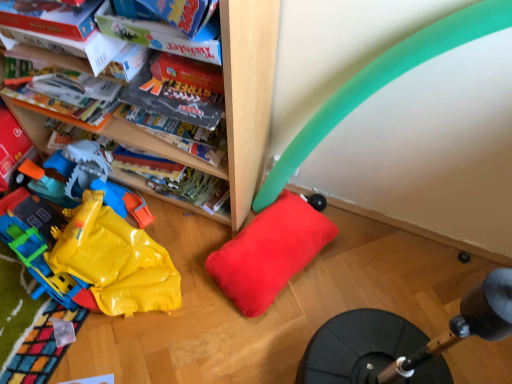
Where is `soft red pillow at center`? The image size is (512, 384). soft red pillow at center is located at coordinates (269, 252).

The image size is (512, 384). What are the coordinates of `yellow plastic bag at lower left` in the screenshot? It's located at (92, 244).

You are a GUI agent. You are given a task and a screenshot of the screen. Output one action in this format:
    pyautogui.click(x=<x>, y=<y>)
    Task: Click on the soft red pillow at center
    This screenshot has height=384, width=512.
    Given the screenshot: What is the action you would take?
    pyautogui.click(x=269, y=252)

Considering the sizes of objects yellow plastic bag at lower left and soft red pillow at center in the image provided, who is shorter, yellow plastic bag at lower left or soft red pillow at center?

With less height is soft red pillow at center.

How many degrees apart are the facing directions of yellow plastic bag at lower left and soft red pillow at center?

The angular difference between yellow plastic bag at lower left and soft red pillow at center is 175 degrees.

In the scene shown: Does yellow plastic bag at lower left turn towards soft red pillow at center?

No, yellow plastic bag at lower left is not aimed at soft red pillow at center.

Choose the correct answer: Is yellow plastic bag at lower left inside matte cardboard book at upper left or outside it?

yellow plastic bag at lower left is spatially situated outside matte cardboard book at upper left.

From a real-world perspective, which object stands above the other?

matte cardboard book at upper left is physically above.

Does yellow plastic bag at lower left come behind matte cardboard book at upper left?

Yes, the depth of yellow plastic bag at lower left is greater than that of matte cardboard book at upper left.

Between yellow plastic bag at lower left and matte cardboard book at upper left, which one appears on the left side from the viewer's perspective?

yellow plastic bag at lower left is more to the left.

At what (x,y) coordinates should I click in order to perform the action: click on book in front of the soft red pillow at center. Please return your answer as a coordinate pair (x, y). The width and height of the screenshot is (512, 384). Looking at the image, I should click on (50, 17).

Does matte cardboard book at upper left touch soft red pillow at center?

No, matte cardboard book at upper left is not next to soft red pillow at center.

Does point (66, 31) appear closer or farther from the camera than point (276, 244)?

Point (66, 31) is closer to the camera than point (276, 244).

Measure the distance from matte cardboard book at upper left to soft red pillow at center.

The distance of matte cardboard book at upper left from soft red pillow at center is 81.71 centimeters.

Is yellow plastic bag at lower left surrounded by soft red pillow at center?

No.

Is point (296, 213) positioned after point (20, 231)?

No, (296, 213) is closer to viewer.

How much distance is there between soft red pillow at center and yellow plastic bag at lower left?

soft red pillow at center and yellow plastic bag at lower left are 37.30 centimeters apart from each other.

Would you say soft red pillow at center is inside or outside matte cardboard book at upper left?

soft red pillow at center cannot be found inside matte cardboard book at upper left.

Based on the photo, considering the relative sizes of soft red pillow at center and matte cardboard book at upper left in the image provided, is soft red pillow at center taller than matte cardboard book at upper left?

Indeed, soft red pillow at center has a greater height compared to matte cardboard book at upper left.

Is soft red pillow at center to the left or to the right of matte cardboard book at upper left in the image?

soft red pillow at center is positioned on matte cardboard book at upper left's right side.

Is matte cardboard book at upper left at the right side of yellow plastic bag at lower left?

Yes.

Considering the positions of points (81, 21) and (178, 285), is point (81, 21) farther from camera compared to point (178, 285)?

No.

Is matte cardboard book at upper left bigger or smaller than yellow plastic bag at lower left?

matte cardboard book at upper left is smaller than yellow plastic bag at lower left.

Is matte cardboard book at upper left touching yellow plastic bag at lower left?

There is a gap between matte cardboard book at upper left and yellow plastic bag at lower left.

Where is `toy located on the left of soft red pillow at center`? toy located on the left of soft red pillow at center is located at coordinates (92, 244).

The image size is (512, 384). Find the location of `toy directly beneath the matte cardboard book at upper left (from a real-world perspective)`. toy directly beneath the matte cardboard book at upper left (from a real-world perspective) is located at coordinates (92, 244).

From the image, which object appears to be farther from yellow plastic bag at lower left, matte cardboard book at upper left or soft red pillow at center?

matte cardboard book at upper left.

From the image, which object appears to be nearer to soft red pillow at center, matte cardboard book at upper left or yellow plastic bag at lower left?

yellow plastic bag at lower left.

When comparing their distances from matte cardboard book at upper left, does soft red pillow at center or yellow plastic bag at lower left seem closer?

yellow plastic bag at lower left lies closer to matte cardboard book at upper left than the other object.

Which object lies nearer to the anchor point soft red pillow at center, yellow plastic bag at lower left or matte cardboard book at upper left?

Based on the image, yellow plastic bag at lower left appears to be nearer to soft red pillow at center.

Which object lies nearer to the anchor point yellow plastic bag at lower left, soft red pillow at center or matte cardboard book at upper left?

soft red pillow at center is closer to yellow plastic bag at lower left.

Considering their positions, is yellow plastic bag at lower left positioned further to matte cardboard book at upper left than soft red pillow at center?

soft red pillow at center is positioned further to the anchor matte cardboard book at upper left.

Where is `book located between yellow plastic bag at lower left and soft red pillow at center in the left-right direction`? The height and width of the screenshot is (384, 512). book located between yellow plastic bag at lower left and soft red pillow at center in the left-right direction is located at coordinates (50, 17).